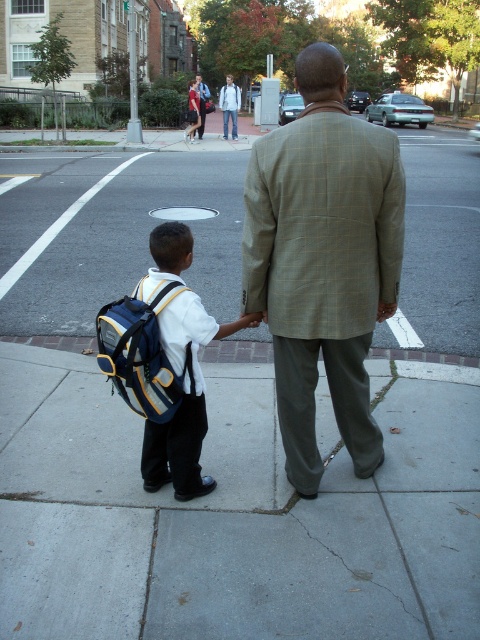
Question: In this image, where is gray concrete sidewalk at center located relative to blue/yellow fabric backpack at lower left?

Choices:
 (A) left
 (B) right

Answer: (B)

Question: Considering the relative positions of plaid wool blazer at center and blue fabric backpack at lower left in the image provided, where is plaid wool blazer at center located with respect to blue fabric backpack at lower left?

Choices:
 (A) right
 (B) left

Answer: (A)

Question: Does gray concrete sidewalk at center appear over blue fabric backpack at lower left?

Choices:
 (A) no
 (B) yes

Answer: (A)

Question: Which point is farther to the camera?

Choices:
 (A) blue fabric backpack at lower left
 (B) gray concrete sidewalk at center
 (C) blue/yellow fabric backpack at lower left

Answer: (A)

Question: Which object appears farthest from the camera in this image?

Choices:
 (A) gray concrete sidewalk at center
 (B) blue fabric backpack at lower left

Answer: (B)

Question: Which point appears closest to the camera in this image?

Choices:
 (A) (107, 346)
 (B) (382, 451)
 (C) (194, 323)
 (D) (334, 579)

Answer: (D)